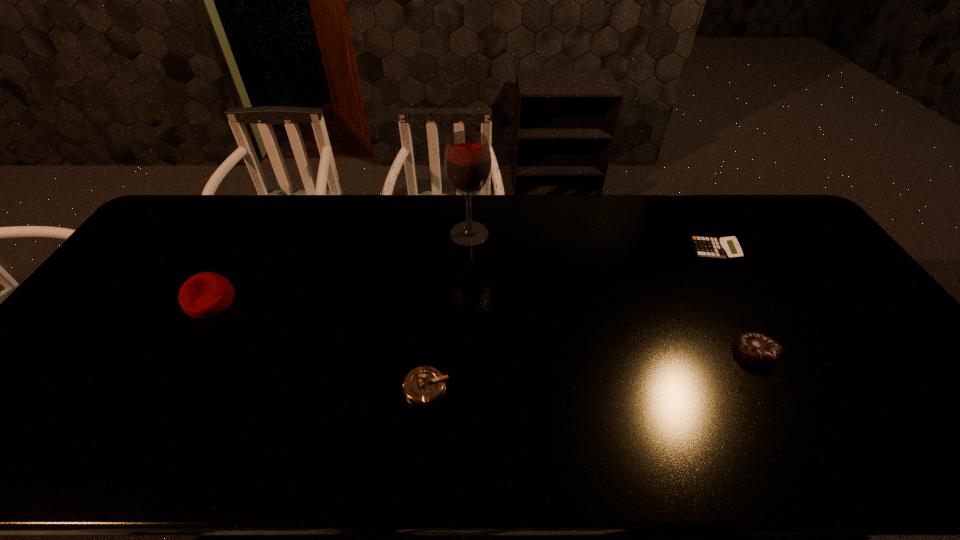
The width and height of the screenshot is (960, 540). Identify the location of vacant space that's between the ashtray and the calculator. (570, 319).

I want to click on vacant area that lies between the shorter beanbag and the alcohol, so click(x=612, y=293).

Locate an element on the screen. This screenshot has height=540, width=960. free space between the calculator and the ashtray is located at coordinates (570, 319).

This screenshot has width=960, height=540. I want to click on vacant region between the tallest object and the third nearest object, so click(x=340, y=267).

This screenshot has height=540, width=960. What are the coordinates of `unoccupied position between the ashtray and the taller beanbag` in the screenshot? It's located at (318, 344).

This screenshot has width=960, height=540. I want to click on free spot between the farther beanbag and the third tallest object, so click(x=483, y=327).

Identify which object is located as the fourth nearest to the ashtray. Please provide its 2D coordinates. Your answer should be formatted as a tuple, i.e. [(x, y)], where the tuple contains the x and y coordinates of a point satisfying the conditions above.

[(728, 248)]

Identify which object is the fourth closest to the calculator. Please provide its 2D coordinates. Your answer should be formatted as a tuple, i.e. [(x, y)], where the tuple contains the x and y coordinates of a point satisfying the conditions above.

[(203, 295)]

At what (x,y) coordinates should I click in order to perform the action: click on free spot that satisfies the following two spatial constraints: 1. on the seat area of the ashtray; 2. on the left side of the leftmost object. Please return your answer as a coordinate pair (x, y). Looking at the image, I should click on coord(160,387).

Find the location of a particular element. This screenshot has height=540, width=960. free location that satisfies the following two spatial constraints: 1. on the seat area of the ashtray; 2. on the right side of the third nearest object is located at coordinates (160, 387).